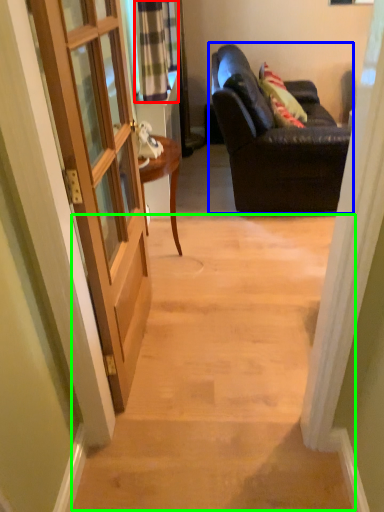
Question: Based on their relative distances, which object is nearer to curtain (highlighted by a red box)? Choose from studio couch (highlighted by a blue box) and stairwell (highlighted by a green box).

Choices:
 (A) studio couch
 (B) stairwell

Answer: (A)